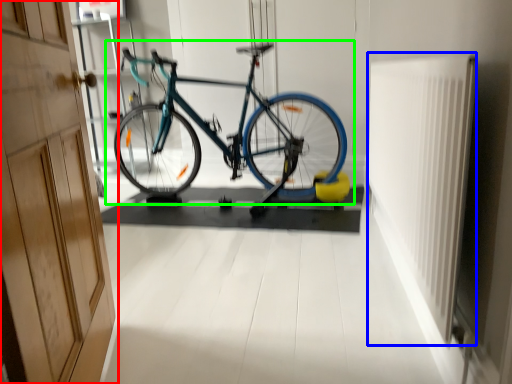
Question: Based on their relative distances, which object is farther from door (highlighted by a red box)? Choose from radiator (highlighted by a blue box) and bicycle (highlighted by a green box).

Choices:
 (A) radiator
 (B) bicycle

Answer: (B)